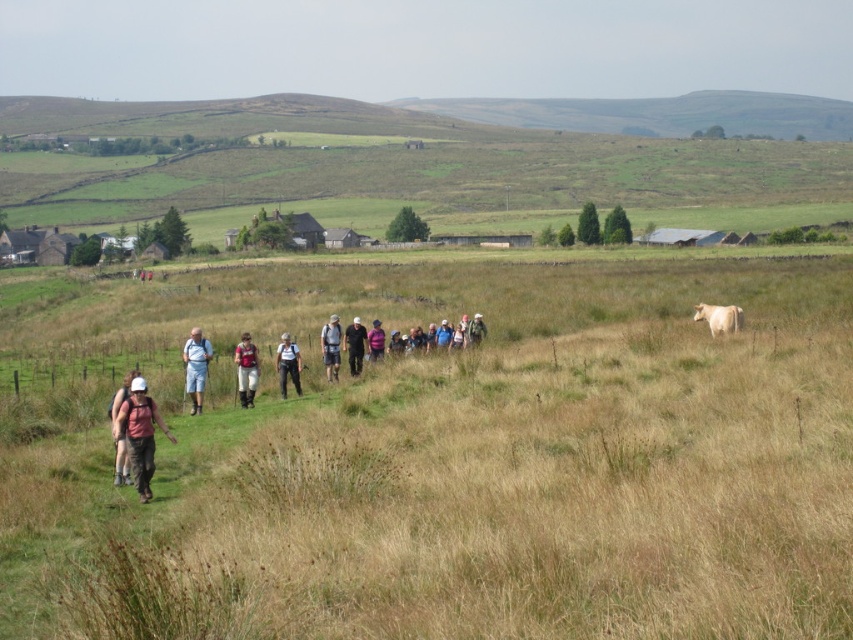
You are a hiker who wants to reach the farmhouse in the background. You see the matte red backpack at center and the purple fabric jacket at center. Which object is closer to you?

The matte red backpack at center is closer to the viewer than the purple fabric jacket at center, so the matte red backpack at center is closer to you.

You are a hiker looking at the scene and notice two items at the center of the image. Which item is positioned lower down between the matte red backpack at center and the purple fabric jacket at center?

The matte red backpack at center is located below the purple fabric jacket at center, so it is positioned lower down.

You are a photographer trying to capture the hikers in the scene. You notice the light blue denim shorts at center in the image. Based on its position, can you estimate where in the frame this shorts would be located?

The light blue denim shorts at center is located at point 0.575 on the horizontal axis and 0.231 on the vertical axis of the frame.